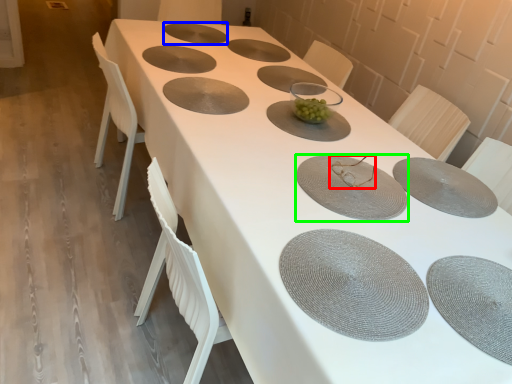
Question: Which object is the farthest from tableware (highlighted by a red box)? Choose among these: tableware (highlighted by a blue box) or tableware (highlighted by a green box).

Choices:
 (A) tableware
 (B) tableware

Answer: (A)